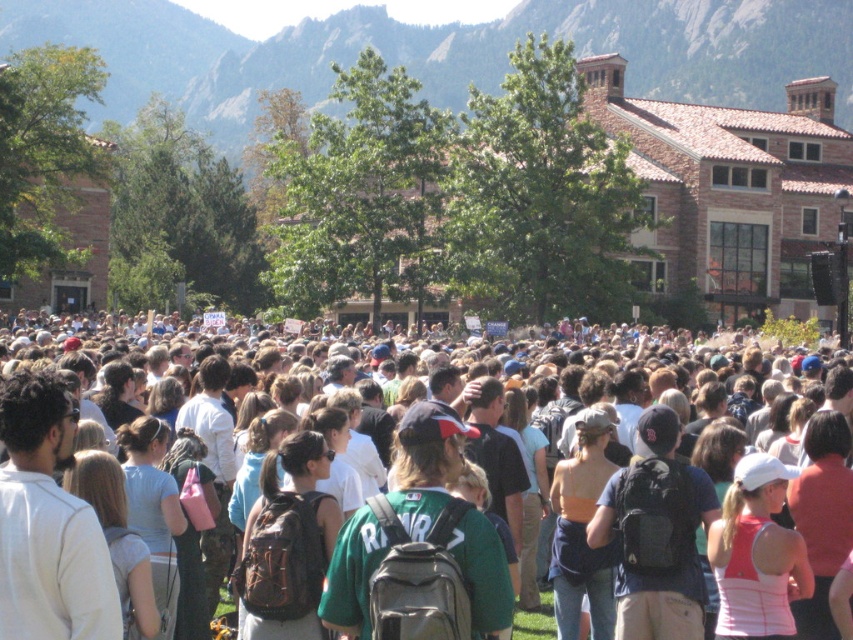
Which is above, multicolored casual clothing at center or rugged stone mountain at upper center?

rugged stone mountain at upper center

Is multicolored casual clothing at center wider than rugged stone mountain at upper center?

In fact, multicolored casual clothing at center might be narrower than rugged stone mountain at upper center.

Image resolution: width=853 pixels, height=640 pixels. What do you see at coordinates (381, 544) in the screenshot?
I see `multicolored casual clothing at center` at bounding box center [381, 544].

In order to click on multicolored casual clothing at center in this screenshot , I will do `click(381, 544)`.